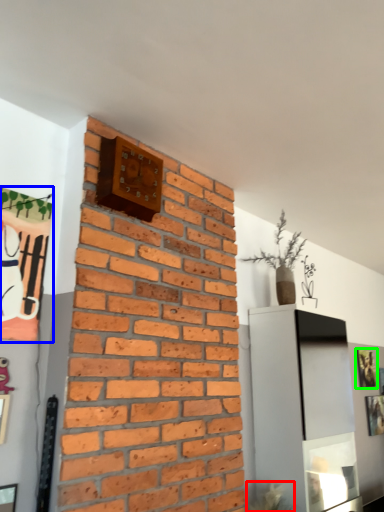
Question: Which object is the closest to the plant (highlighted by a red box)? Choose among these: picture frame (highlighted by a blue box) or picture frame (highlighted by a green box).

Choices:
 (A) picture frame
 (B) picture frame

Answer: (B)